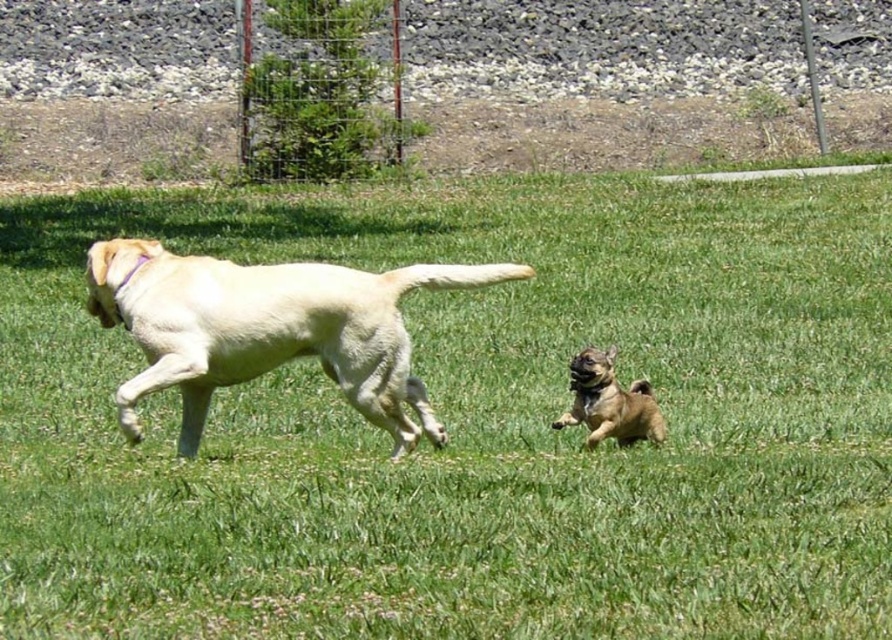
Based on the scene description, which object is taller between the green grass at center and the light yellow fur at center?

The green grass at center is taller than the light yellow fur at center.

You are a photographer trying to capture a photo of the two dogs playing. You notice the green grass at center and the light yellow fur at center in your viewfinder. Which object should you focus on first if you want to ensure both dogs are in sharp focus?

The green grass at center is above the light yellow fur at center. To ensure both dogs are in sharp focus, you should focus on the green grass at center first since it is closer to the camera and adjusting focus from there will help capture both elements clearly.